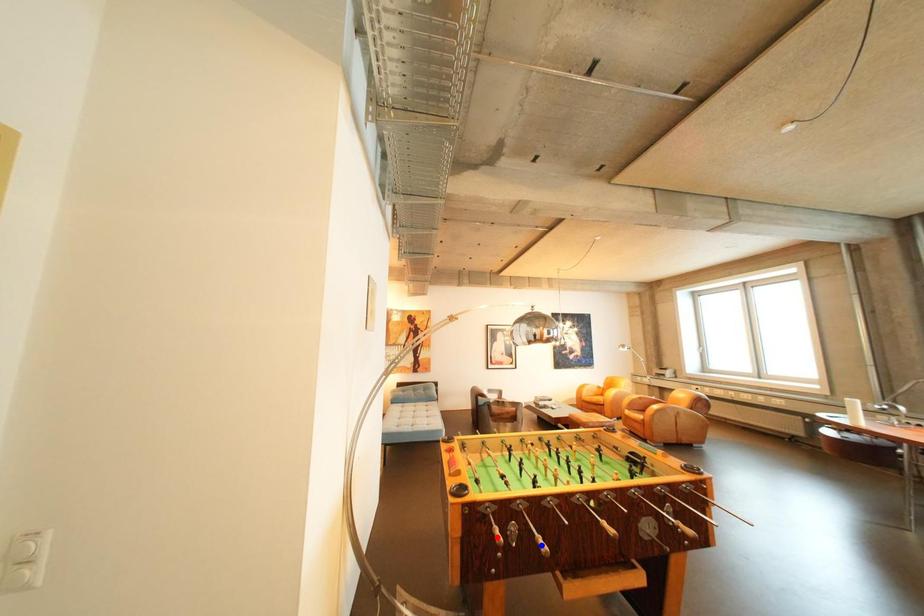
Question: In the image, two points are highlighted. Which point is nearer to the camera? Reply with the corresponding letter.

Choices:
 (A) blue point
 (B) red point

Answer: (A)